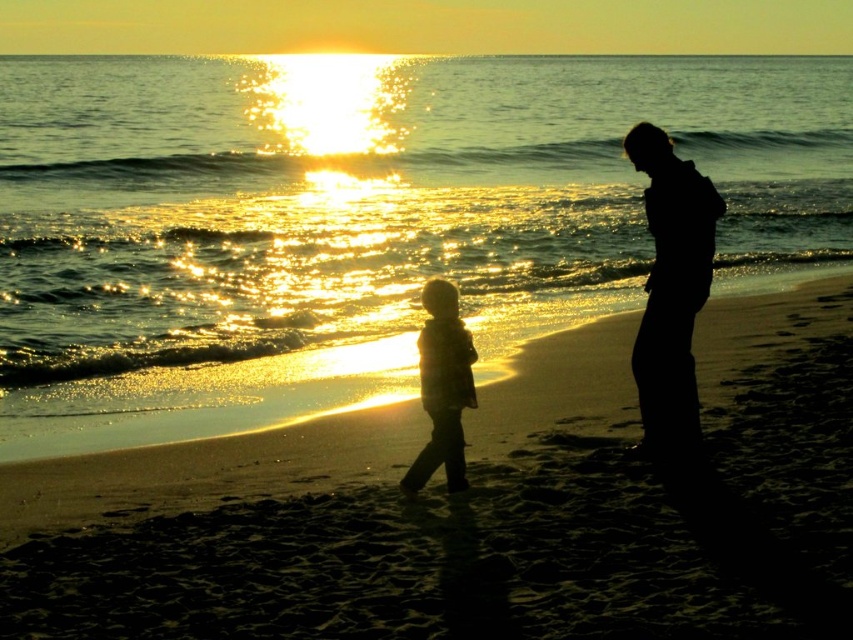
Does silhouette clothing at right have a smaller size compared to silhouette child at center?

No.

Does point (653, 234) come in front of point (405, 490)?

No, (653, 234) is behind (405, 490).

Which is in front, point (641, 147) or point (445, 346)?

Positioned in front is point (445, 346).

At what (x,y) coordinates should I click in order to perform the action: click on silhouette clothing at right. Please return your answer as a coordinate pair (x, y). This screenshot has width=853, height=640. Looking at the image, I should click on (671, 288).

Who is lower down, shiny golden water at center or silhouette child at center?

silhouette child at center is below.

Is shiny golden water at center behind silhouette child at center?

Yes, it is.

The image size is (853, 640). What do you see at coordinates (366, 205) in the screenshot?
I see `shiny golden water at center` at bounding box center [366, 205].

At what (x,y) coordinates should I click in order to perform the action: click on shiny golden water at center. Please return your answer as a coordinate pair (x, y). This screenshot has height=640, width=853. Looking at the image, I should click on [366, 205].

Is point (398, 240) positioned after point (756, 412)?

Yes, it is.

Between point (773, 77) and point (538, 532), which one is positioned in front?

Positioned in front is point (538, 532).

Is point (316, 106) behind point (550, 528)?

Yes.

Locate an element on the screen. shiny golden water at center is located at coordinates (366, 205).